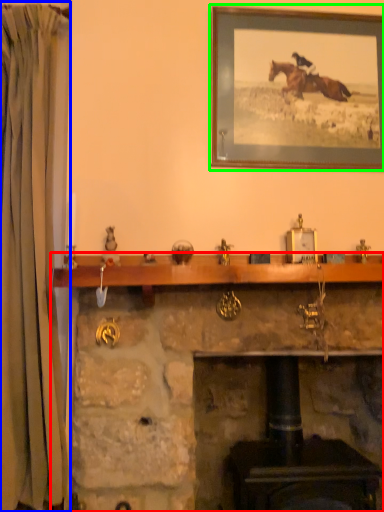
Question: Which object is the farthest from fireplace (highlighted by a red box)? Choose among these: curtain (highlighted by a blue box) or picture frame (highlighted by a green box).

Choices:
 (A) curtain
 (B) picture frame

Answer: (B)